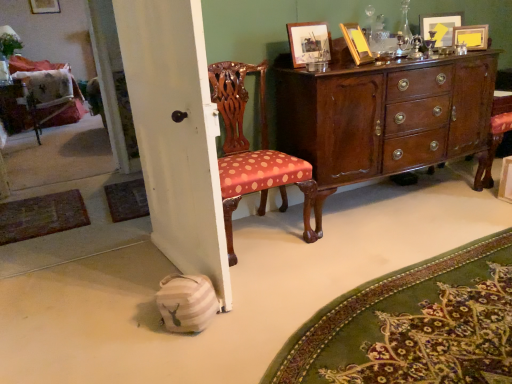
In order to face green felt mat at lower left, which appears as the second mat when viewed from the back, should I rotate leftwards or rightwards?

Turn left approximately 26.749 degrees to face it.

Find the location of a particular element. wooden picture frame at upper left, the 5th picture frame positioned from the right is located at coordinates (44, 6).

Locate an element on the screen. matte wooden picture frame at upper center, the 2th picture frame in the bottom-to-top sequence is located at coordinates (309, 42).

Is wooden picture frame at upper right, the 5th picture frame when ordered from back to front, looking in the opposite direction of green felt mat at lower left, the 1th mat when ordered from left to right?

No.

Which object is closer to the camera taking this photo, wooden picture frame at upper right, which is the 3th picture frame from right to left, or green felt mat at lower left, the third mat from the right?

wooden picture frame at upper right, which is the 3th picture frame from right to left.

Is wooden picture frame at upper right, which is the 3th picture frame from right to left, next to green felt mat at lower left, the 1th mat when ordered from left to right?

No, wooden picture frame at upper right, which is the 3th picture frame from right to left, is not with green felt mat at lower left, the 1th mat when ordered from left to right.

Can green felt mat at lower left, the third mat from the right, be found inside wooden picture frame at upper right, marked as the first picture frame in a bottom-to-top arrangement?

No, green felt mat at lower left, the third mat from the right, is not a part of wooden picture frame at upper right, marked as the first picture frame in a bottom-to-top arrangement.

Which object is closer to the camera, polished dark wood cabinet at center or polished wood chair at center?

polished wood chair at center is in front.

Looking at this image, is polished dark wood cabinet at center shorter than polished wood chair at center?

Yes.

Choose the correct answer: Is polished dark wood cabinet at center inside polished wood chair at center or outside it?

polished dark wood cabinet at center exists outside the volume of polished wood chair at center.

Does point (310, 116) come farther from viewer compared to point (227, 118)?

No, it is not.

Looking at this image, is polished wood chair at center aimed at yellow paper at upper right, the first picture frame in the right-to-left sequence?

No, polished wood chair at center is not turned towards yellow paper at upper right, the first picture frame in the right-to-left sequence.

Could you measure the distance between polished wood chair at center and yellow paper at upper right, the first picture frame in the right-to-left sequence?

polished wood chair at center is 4.71 feet away from yellow paper at upper right, the first picture frame in the right-to-left sequence.

Is polished wood chair at center taller or shorter than yellow paper at upper right, which ranks as the third picture frame in back-to-front order?

In the image, polished wood chair at center appears to be taller than yellow paper at upper right, which ranks as the third picture frame in back-to-front order.

Are polished wood chair at center and yellow paper at upper right, which is the third picture frame from bottom to top, far apart?

Indeed, polished wood chair at center is not near yellow paper at upper right, which is the third picture frame from bottom to top.

From a real-world perspective, between matte wooden picture frame at upper center, which is counted as the fourth picture frame, starting from the top, and woven brown mat at lower left, the 2th mat in the left-to-right sequence, who is vertically higher?

From a 3D spatial view, matte wooden picture frame at upper center, which is counted as the fourth picture frame, starting from the top, is above.

How different are the orientations of matte wooden picture frame at upper center, the 2th picture frame viewed from the left, and woven brown mat at lower left, the 2th mat in the left-to-right sequence, in degrees?

The facing directions of matte wooden picture frame at upper center, the 2th picture frame viewed from the left, and woven brown mat at lower left, the 2th mat in the left-to-right sequence, are 6.24 degrees apart.

You are a GUI agent. You are given a task and a screenshot of the screen. Output one action in this format:
    pyautogui.click(x=<x>, y=<y>)
    Task: Click on the 2nd picture frame above the woven brown mat at lower left, the 2th mat in the left-to-right sequence (from the image's perspective)
    The width and height of the screenshot is (512, 384).
    Given the screenshot: What is the action you would take?
    pyautogui.click(x=309, y=42)

Looking at this image, in the image, is matte wooden picture frame at upper center, the 2th picture frame viewed from the left, positioned in front of or behind woven brown mat at lower left, which ranks as the 1th mat in back-to-front order?

In the image, matte wooden picture frame at upper center, the 2th picture frame viewed from the left, appears in front of woven brown mat at lower left, which ranks as the 1th mat in back-to-front order.

Is beige woven mat at lower left, placed as the 1th mat when sorted from right to left, looking in the opposite direction of wooden picture frame at upper right, which is the fifth picture frame from top to bottom?

No, beige woven mat at lower left, placed as the 1th mat when sorted from right to left, is not facing the opposite direction of wooden picture frame at upper right, which is the fifth picture frame from top to bottom.

Is beige woven mat at lower left, which is counted as the third mat, starting from the back, bigger than wooden picture frame at upper right, which is the fifth picture frame from top to bottom?

Yes, beige woven mat at lower left, which is counted as the third mat, starting from the back, is bigger than wooden picture frame at upper right, which is the fifth picture frame from top to bottom.

Which object is wider, beige woven mat at lower left, which is counted as the third mat, starting from the back, or wooden picture frame at upper right, which is the 3th picture frame in left-to-right order?

With larger width is beige woven mat at lower left, which is counted as the third mat, starting from the back.

Is point (425, 301) farther from viewer compared to point (357, 53)?

No.

Based on the photo, who is more distant, wooden picture frame at upper left, which is the first picture frame in left-to-right order, or matte wooden picture frame at upper center, the 2th picture frame viewed from the left?

wooden picture frame at upper left, which is the first picture frame in left-to-right order, is further away from the camera.

Visually, is wooden picture frame at upper left, which appears as the fifth picture frame when viewed from the front, positioned to the left or to the right of matte wooden picture frame at upper center, the fourth picture frame from the back?

wooden picture frame at upper left, which appears as the fifth picture frame when viewed from the front, is to the left of matte wooden picture frame at upper center, the fourth picture frame from the back.

Based on the photo, between wooden picture frame at upper left, which appears as the fifth picture frame when viewed from the front, and matte wooden picture frame at upper center, which is counted as the fourth picture frame, starting from the top, which one has larger width?

matte wooden picture frame at upper center, which is counted as the fourth picture frame, starting from the top.

Could you tell me if wooden picture frame at upper left, the 5th picture frame positioned from the bottom, is turned towards matte wooden picture frame at upper center, the 2th picture frame in the bottom-to-top sequence?

Yes, wooden picture frame at upper left, the 5th picture frame positioned from the bottom, faces towards matte wooden picture frame at upper center, the 2th picture frame in the bottom-to-top sequence.

In the scene shown: Considering the relative sizes of polka dot fabric swivel chair at left and woven brown mat at lower left, which ranks as the 1th mat in back-to-front order, in the image provided, is polka dot fabric swivel chair at left thinner than woven brown mat at lower left, which ranks as the 1th mat in back-to-front order,?

Yes.

Is polka dot fabric swivel chair at left looking in the opposite direction of woven brown mat at lower left, which is the third mat from front to back?

That's not correct — polka dot fabric swivel chair at left is not looking away from woven brown mat at lower left, which is the third mat from front to back.

Is polka dot fabric swivel chair at left taller or shorter than woven brown mat at lower left, which ranks as the 1th mat in back-to-front order?

In the image, polka dot fabric swivel chair at left appears to be taller than woven brown mat at lower left, which ranks as the 1th mat in back-to-front order.

Is polka dot fabric swivel chair at left smaller than woven brown mat at lower left, the 2th mat in the left-to-right sequence?

Incorrect, polka dot fabric swivel chair at left is not smaller in size than woven brown mat at lower left, the 2th mat in the left-to-right sequence.

The width and height of the screenshot is (512, 384). In order to click on the 3rd picture frame positioned above the green felt mat at lower left, the 1th mat when ordered from left to right (from a real-world perspective) in this screenshot , I will do `click(356, 43)`.

Identify the location of cabinetry that is behind the polished wood chair at center. Image resolution: width=512 pixels, height=384 pixels. (384, 118).

When comparing their distances from polka dot fabric swivel chair at left, does wooden picture frame at upper left, marked as the 1th picture frame in a back-to-front arrangement, or matte yellow picture frame at upper right, the 4th picture frame when ordered from front to back, seem closer?

wooden picture frame at upper left, marked as the 1th picture frame in a back-to-front arrangement, lies closer to polka dot fabric swivel chair at left than the other object.

Looking at the image, which one is located closer to matte wooden picture frame at upper center, acting as the 4th picture frame starting from the right, polka dot fabric swivel chair at left or wooden picture frame at upper right, which is the 3th picture frame in left-to-right order?

wooden picture frame at upper right, which is the 3th picture frame in left-to-right order.

Considering their positions, is wooden picture frame at upper right, which is the 3th picture frame from right to left, positioned further to wooden picture frame at upper left, marked as the 1th picture frame in a back-to-front arrangement, than polished dark wood cabinet at center?

polished dark wood cabinet at center is positioned further to the anchor wooden picture frame at upper left, marked as the 1th picture frame in a back-to-front arrangement.

When comparing their distances from matte wooden picture frame at upper center, the 2th picture frame in the bottom-to-top sequence, does white painted wood door at lower left or polka dot fabric swivel chair at left seem closer?

white painted wood door at lower left is closer to matte wooden picture frame at upper center, the 2th picture frame in the bottom-to-top sequence.

From the image, which object appears to be nearer to matte wooden picture frame at upper center, the 2th picture frame viewed from the left, beige woven mat at lower left, the 3th mat when ordered from left to right, or wooden picture frame at upper right, the 5th picture frame when ordered from back to front?

Among the two, wooden picture frame at upper right, the 5th picture frame when ordered from back to front, is located nearer to matte wooden picture frame at upper center, the 2th picture frame viewed from the left.

From the image, which object appears to be farther from woven brown mat at lower left, which ranks as the 1th mat in back-to-front order, yellow paper at upper right, which is the third picture frame from bottom to top, or matte wooden picture frame at upper center, the 2th picture frame in the bottom-to-top sequence?

yellow paper at upper right, which is the third picture frame from bottom to top, is positioned further to the anchor woven brown mat at lower left, which ranks as the 1th mat in back-to-front order.

Which object lies nearer to the anchor point matte yellow picture frame at upper right, acting as the fourth picture frame starting from the bottom, beige woven mat at lower left, which is counted as the third mat, starting from the back, or yellow paper at upper right, acting as the fifth picture frame starting from the left?

Based on the image, yellow paper at upper right, acting as the fifth picture frame starting from the left, appears to be nearer to matte yellow picture frame at upper right, acting as the fourth picture frame starting from the bottom.

Looking at the image, which one is located further to polished dark wood cabinet at center, matte yellow picture frame at upper right, acting as the fourth picture frame starting from the bottom, or yellow paper at upper right, which ranks as the third picture frame in back-to-front order?

yellow paper at upper right, which ranks as the third picture frame in back-to-front order.

Locate an element on the screen. The image size is (512, 384). chair between beige woven mat at lower left, which is counted as the third mat, starting from the back, and polka dot fabric swivel chair at left from front to back is located at coordinates (253, 152).

Where is `cabinetry situated between matte wooden picture frame at upper center, positioned as the 2th picture frame in front-to-back order, and yellow paper at upper right, the 3th picture frame from the top, from left to right`? The image size is (512, 384). cabinetry situated between matte wooden picture frame at upper center, positioned as the 2th picture frame in front-to-back order, and yellow paper at upper right, the 3th picture frame from the top, from left to right is located at coordinates (x=384, y=118).

Image resolution: width=512 pixels, height=384 pixels. Identify the location of chair between beige woven mat at lower left, marked as the 1th mat in a front-to-back arrangement, and yellow paper at upper right, which ranks as the third picture frame in back-to-front order, along the z-axis. (253, 152).

In order to click on door between woven brown mat at lower left, which ranks as the 1th mat in back-to-front order, and yellow paper at upper right, the first picture frame in the right-to-left sequence in this screenshot , I will do `click(176, 133)`.